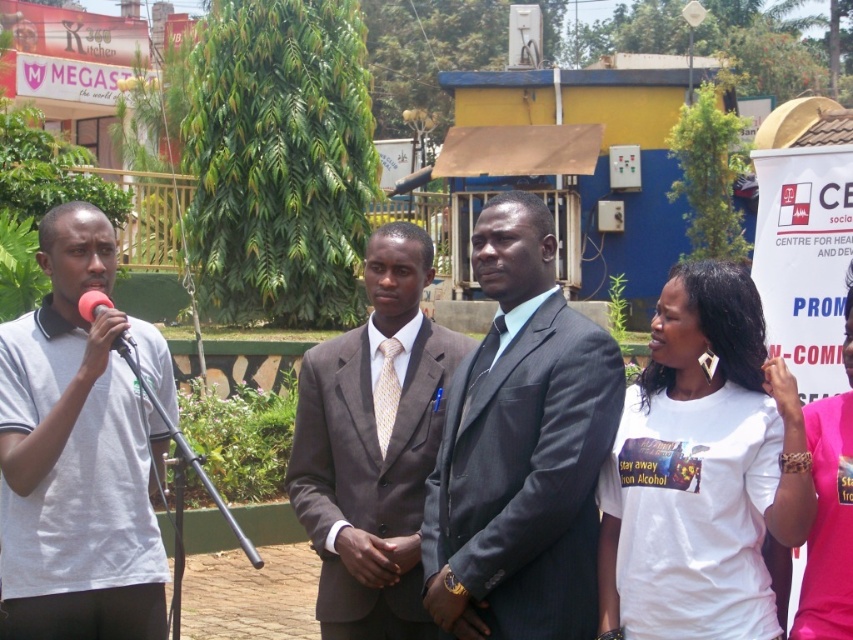
You are a photographer standing at the front of the event. You need to take a group photo of the two men in dark gray pinstripe suit at center and the man on the left wearing brown suit with white shirt. The camera you are using has a maximum focus range of 5 meters. Will you be able to capture both of them clearly in the photo?

The two men in dark gray pinstripe suit at center and the man on the left wearing brown suit with white shirt are 5.47 meters apart. Since the camera has a maximum focus range of 5 meters, the distance between them exceeds the camera capability. Therefore, you cannot capture both clearly in the same photo.

Based on the scene description, what are the coordinates of the white matte shirt at left?

The white matte shirt at left is located at coordinates point (x=79, y=452).